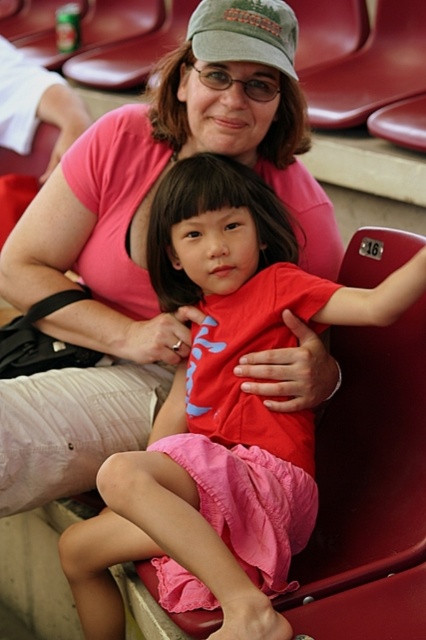
You are a photographer taking a picture of the two people in the stadium seats. You want to ensure the pink cotton shirt at center and the green fabric cap at upper center are both clearly visible. Which object should you focus on first to ensure both are in frame?

The pink cotton shirt at center is positioned on the left side of green fabric cap at upper center, so focusing on the pink cotton shirt at center first will ensure both objects are in frame since it is closer to the left edge.

You are a photographer trying to capture a closeup of the red matte shirt at center and the green fabric cap at upper center. Which object should you zoom in on more to ensure both are in focus?

The red matte shirt at center is bigger than the green fabric cap at upper center, so you should zoom in more on the green fabric cap at upper center to ensure both are in focus.